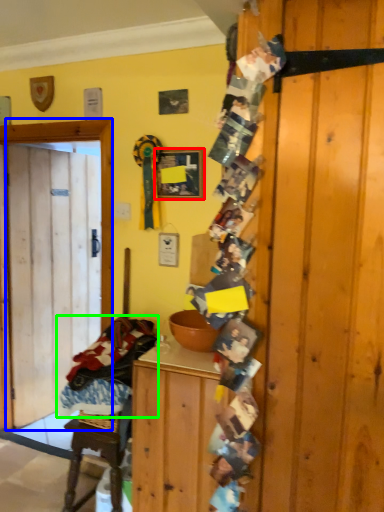
Question: Considering the real-world distances, which object is closest to picture frame (highlighted by a red box)? door (highlighted by a blue box) or laundry (highlighted by a green box).

Choices:
 (A) door
 (B) laundry

Answer: (A)